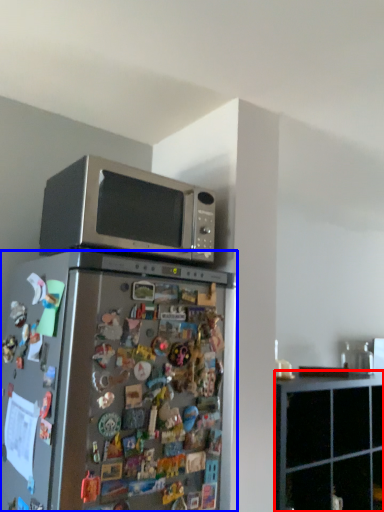
Question: Which object is closer to the camera taking this photo, cabinetry (highlighted by a red box) or refrigerator (highlighted by a blue box)?

Choices:
 (A) cabinetry
 (B) refrigerator

Answer: (B)